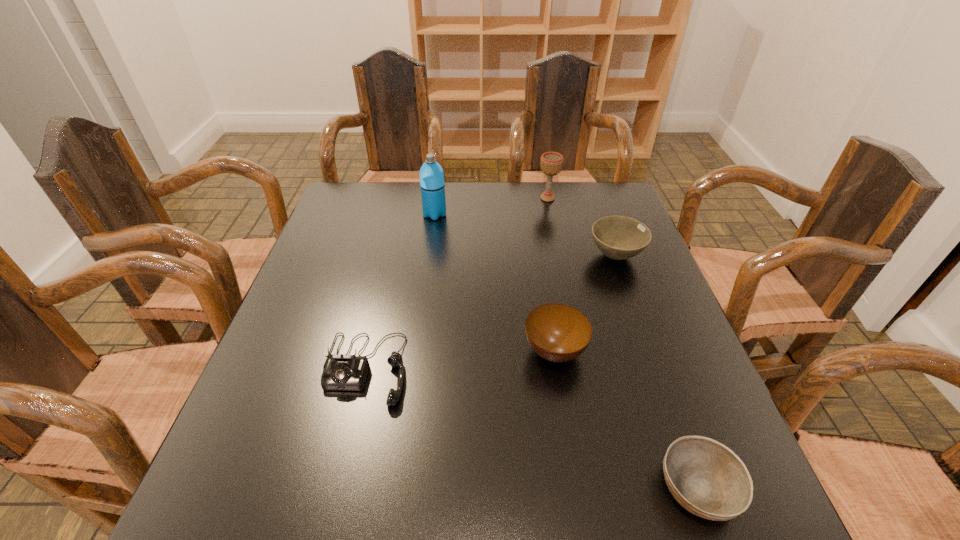
Where is `thermos bottle`? The image size is (960, 540). thermos bottle is located at coordinates (432, 185).

Image resolution: width=960 pixels, height=540 pixels. What are the coordinates of `the fifth nearest object` in the screenshot? It's located at (432, 185).

Where is `the farthest object`? The image size is (960, 540). the farthest object is located at coordinates (551, 164).

The height and width of the screenshot is (540, 960). What are the coordinates of `chalice` in the screenshot? It's located at (551, 164).

The height and width of the screenshot is (540, 960). Find the location of `the farthest bowl`. the farthest bowl is located at coordinates (618, 237).

Locate an element on the screen. The height and width of the screenshot is (540, 960). the second nearest bowl is located at coordinates (557, 332).

Locate an element on the screen. Image resolution: width=960 pixels, height=540 pixels. telephone is located at coordinates (345, 372).

You are a GUI agent. You are given a task and a screenshot of the screen. Output one action in this format:
    pyautogui.click(x=<x>, y=<y>)
    Task: Click on the nearest object
    
    Given the screenshot: What is the action you would take?
    pyautogui.click(x=708, y=479)

At what (x,y) coordinates should I click in order to perform the action: click on the shortest bowl. Please return your answer as a coordinate pair (x, y). Looking at the image, I should click on click(x=708, y=479).

At what (x,y) coordinates should I click in order to perform the action: click on free space located on the front of the thermos bottle. Please return your answer as a coordinate pair (x, y). This screenshot has width=960, height=540. Looking at the image, I should click on (425, 287).